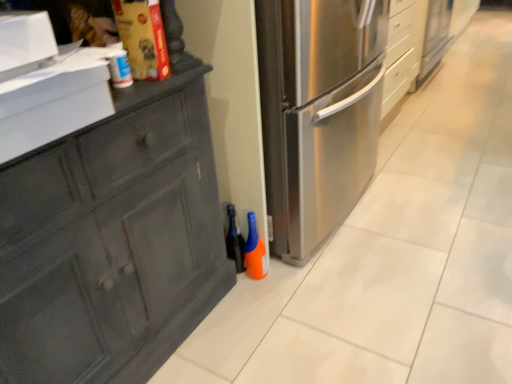
The height and width of the screenshot is (384, 512). Identify the location of empty space that is to the right of orange matte bottle at lower center, which ranks as the second bottle in left-to-right order. (295, 271).